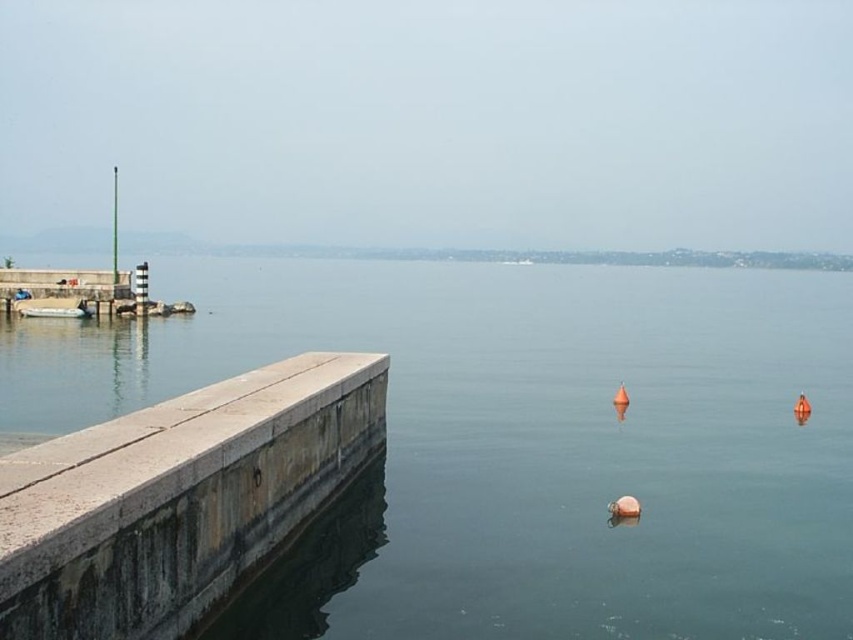
Question: Can you confirm if concrete ledge at left is positioned below white rubber boat at left?

Choices:
 (A) yes
 (B) no

Answer: (A)

Question: Is concrete ledge at left to the left of white rubber boat at left from the viewer's perspective?

Choices:
 (A) no
 (B) yes

Answer: (A)

Question: Can you confirm if transparent water at center is smaller than concrete ledge at left?

Choices:
 (A) no
 (B) yes

Answer: (A)

Question: Which point is closer to the camera?

Choices:
 (A) (33, 308)
 (B) (154, 602)

Answer: (B)

Question: Which point is closer to the camera taking this photo?

Choices:
 (A) (581, 320)
 (B) (53, 588)
 (C) (51, 300)

Answer: (B)

Question: Which point is farther to the camera?

Choices:
 (A) (294, 433)
 (B) (62, 314)
 (C) (791, 420)

Answer: (B)